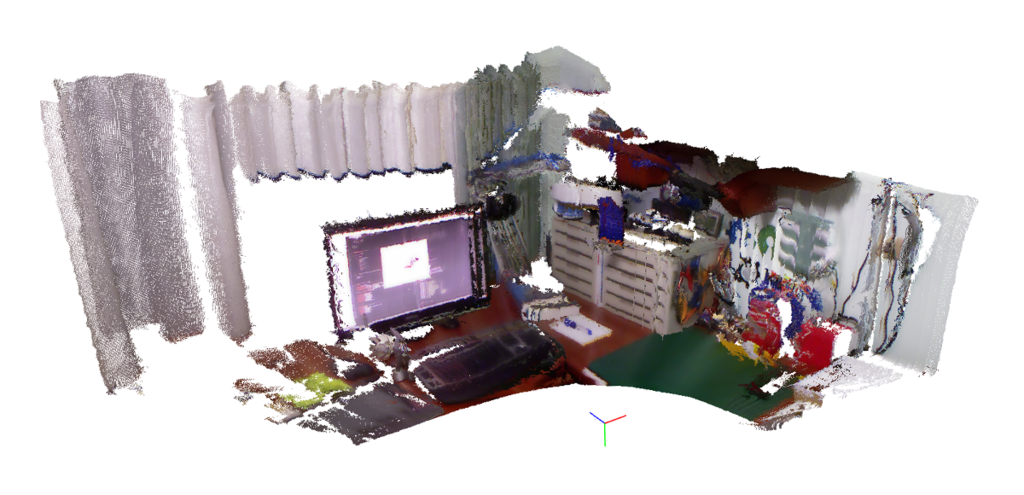
Locate an element on the screen. The image size is (1024, 495). red objects on the desk is located at coordinates (807, 355), (766, 333).